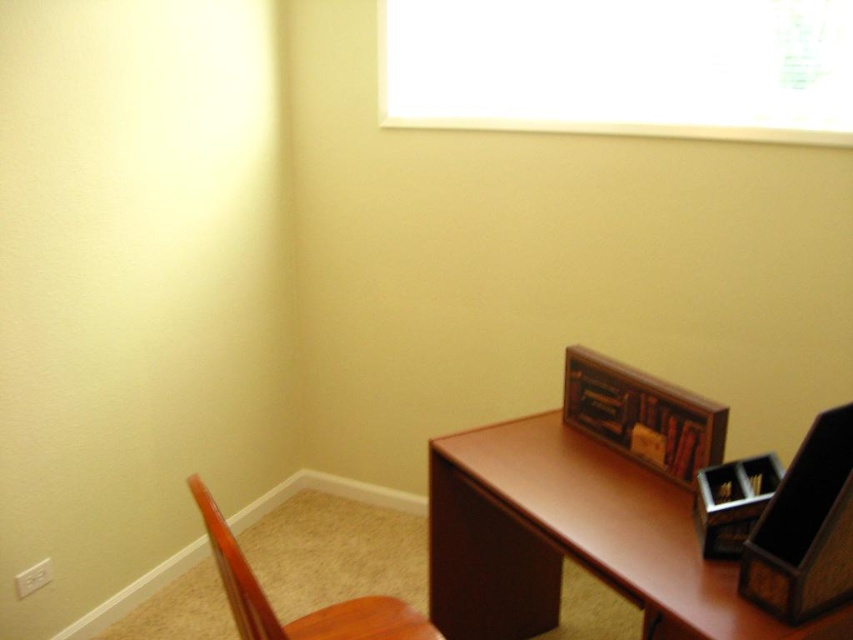
You are standing in the room and want to move from the brown wood computer desk at lower right to the transparent glass window at upper center. Which direction should you move in?

The transparent glass window at upper center is to the right of the brown wood computer desk at lower right, so you should move to the right to reach it.

Based on the photo, you are standing at the entrance of the room and want to move towards the desk. There are two points marked on the floor, point 1 at coordinates (514,116) and point 2 at (451,547). Which point is closer to the desk?

Point 2 at coordinates (451,547) is closer to the desk because it is in front of point 1 at coordinates (514,116).

You are organizing a small party in the room and need to place a 1.2 meter wide table. Can the transparent glass window at upper center and the wooden chair at lower left accommodate this table between them?

The transparent glass window at upper center is larger in size than the wooden chair at lower left, but without knowing the exact distance between them, it is impossible to determine if the table will fit.